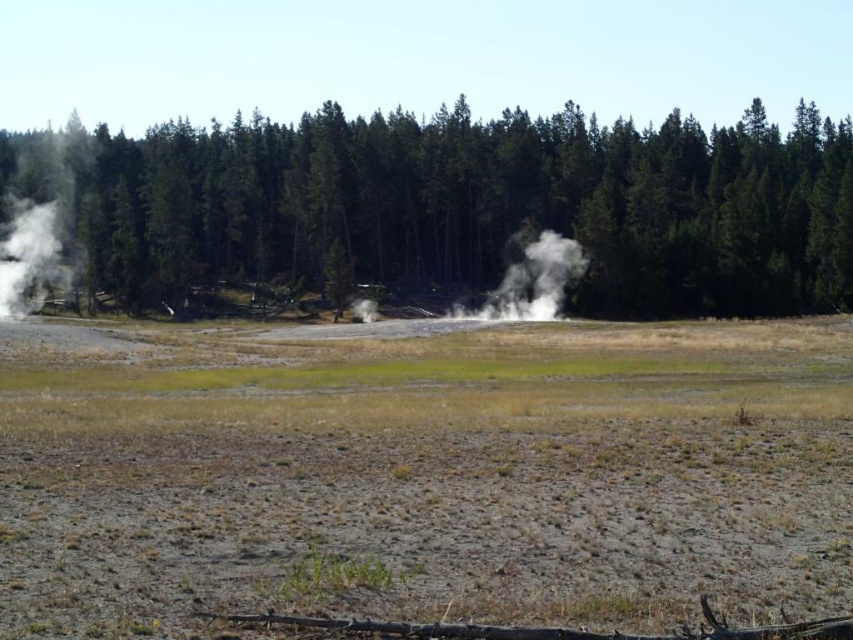
Who is higher up, green matte trees at center or white vapor at center?

green matte trees at center is higher up.

In the scene shown: Is the position of green matte trees at center less distant than that of white vapor at center?

No, green matte trees at center is behind white vapor at center.

Identify the location of green matte trees at center. This screenshot has height=640, width=853. (477, 208).

The height and width of the screenshot is (640, 853). What do you see at coordinates (424, 476) in the screenshot?
I see `dry grass at center` at bounding box center [424, 476].

Which of these two, dry grass at center or white vapor steam at left, stands shorter?

With less height is dry grass at center.

Which is in front, point (341, 458) or point (79, 276)?

Point (341, 458)

The height and width of the screenshot is (640, 853). Find the location of `dry grass at center`. dry grass at center is located at coordinates (424, 476).

Who is lower down, white vapor steam at left or white vapor at center?

white vapor at center is lower down.

Who is more forward, (67, 240) or (544, 291)?

Point (544, 291) is in front.

Where is `white vapor steam at left`? This screenshot has width=853, height=640. white vapor steam at left is located at coordinates (42, 218).